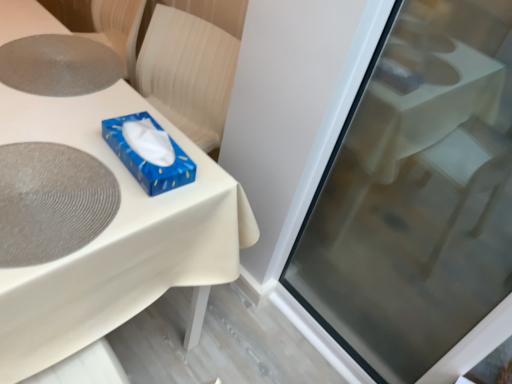
This screenshot has height=384, width=512. I want to click on free point above matte gray placemat at upper left, which is counted as the second oval, starting from the top (from a real-world perspective), so click(x=45, y=184).